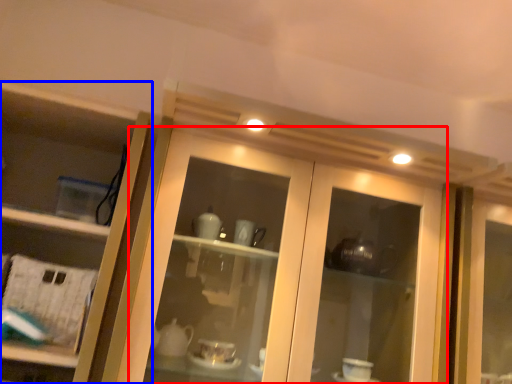
Question: Which of the following is the farthest to the observer, door (highlighted by a red box) or cupboard (highlighted by a blue box)?

Choices:
 (A) door
 (B) cupboard

Answer: (B)